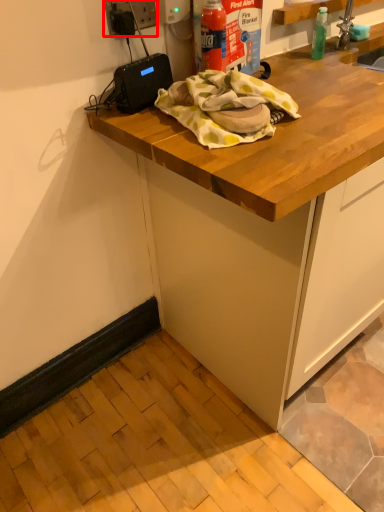
Question: From the image's perspective, what is the correct spatial relationship of electric outlet (annotated by the red box) in relation to cabinetry?

Choices:
 (A) below
 (B) above

Answer: (B)